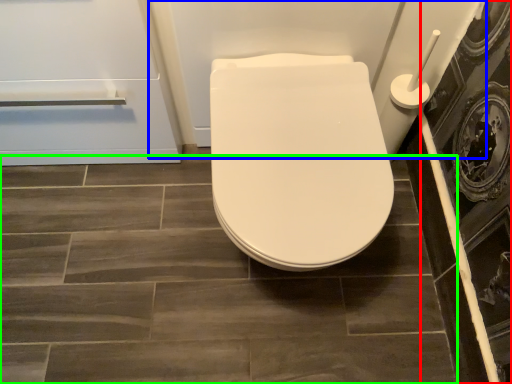
Question: Which is nearer to the screen door (highlighted by a red box)? bath (highlighted by a blue box) or ceramic tile (highlighted by a green box).

Choices:
 (A) bath
 (B) ceramic tile

Answer: (A)